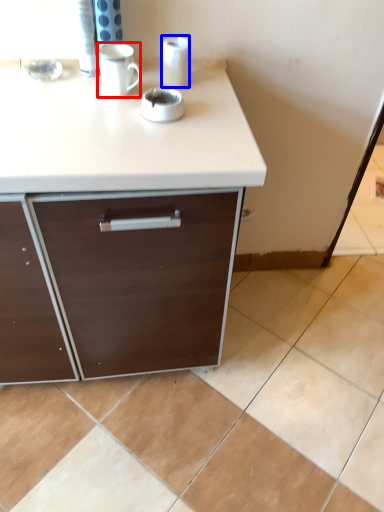
Question: Which object appears farthest to the camera in this image, mug (highlighted by a red box) or paper towel (highlighted by a blue box)?

Choices:
 (A) mug
 (B) paper towel

Answer: (B)